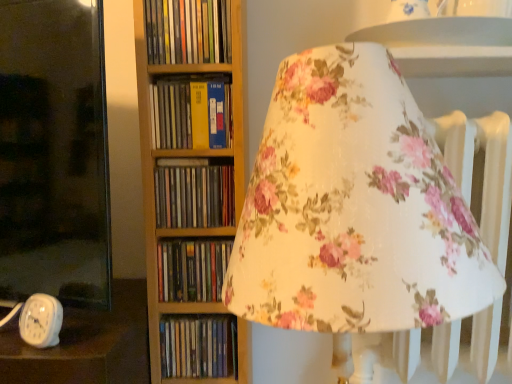
Question: In terms of size, does hardcover books at center, marked as the first book in a top-to-bottom arrangement, appear bigger or smaller than brown cardboard book at center, placed as the third book when sorted from bottom to top?

Choices:
 (A) small
 (B) big

Answer: (A)

Question: From the image's perspective, is hardcover books at center, marked as the first book in a top-to-bottom arrangement, located above or below brown cardboard book at center, which is the 3th book in top-to-bottom order?

Choices:
 (A) above
 (B) below

Answer: (A)

Question: Which object is the closest to the matte plastic books at center, arranged as the 1th book when ordered from the bottom?

Choices:
 (A) brown cardboard book at center, placed as the third book when sorted from bottom to top
 (B) hardcover books at center, marked as the first book in a top-to-bottom arrangement
 (C) matte black book at center, positioned as the fourth book in top-to-bottom order
 (D) yellow matte book at center, which is the 2th book in top-to-bottom order

Answer: (C)

Question: Which is farther from the hardcover books at center, placed as the fifth book when sorted from bottom to top?

Choices:
 (A) brown cardboard book at center, which is the 3th book in top-to-bottom order
 (B) matte plastic books at center, placed as the fifth book when sorted from top to bottom
 (C) matte black book at center, positioned as the fourth book in top-to-bottom order
 (D) yellow matte book at center, placed as the fourth book when sorted from bottom to top

Answer: (B)